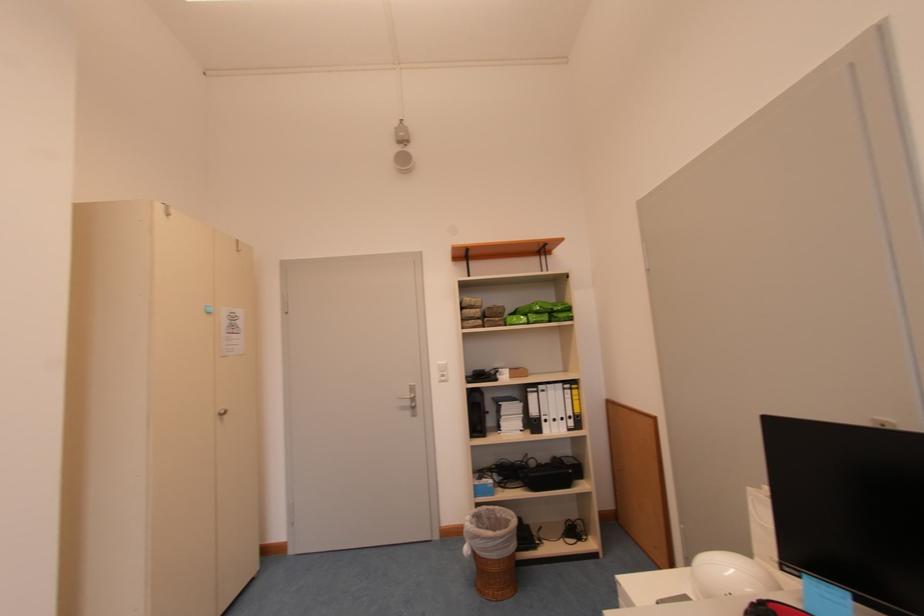
What do you see at coordinates (442, 371) in the screenshot? I see `the white light switch` at bounding box center [442, 371].